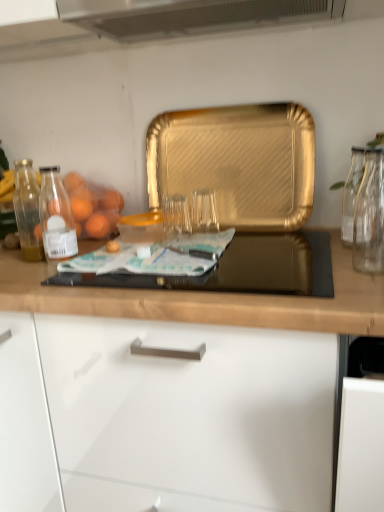
Where is `free location in front of transparent glass at center, the 1th glass jar from the left`? The width and height of the screenshot is (384, 512). free location in front of transparent glass at center, the 1th glass jar from the left is located at coordinates (175, 268).